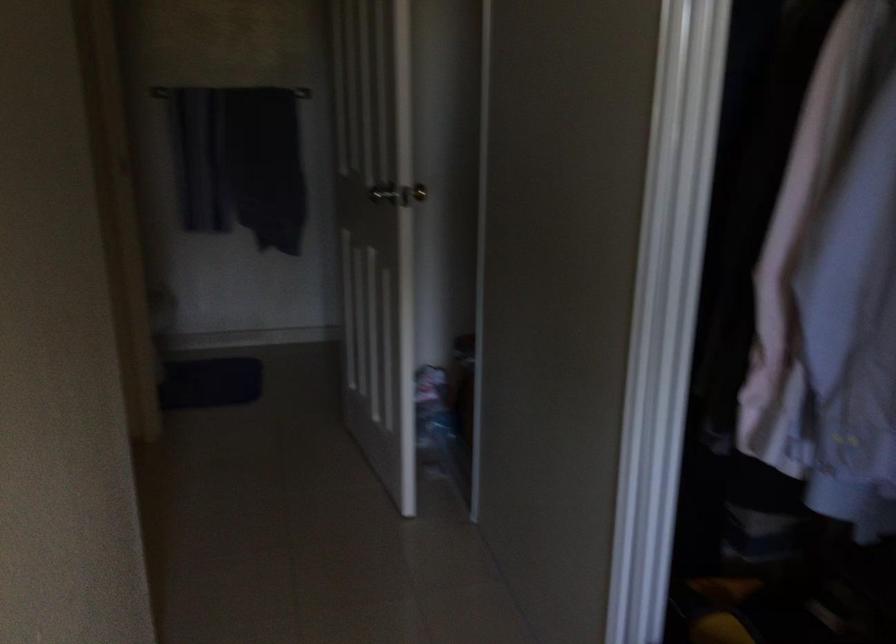
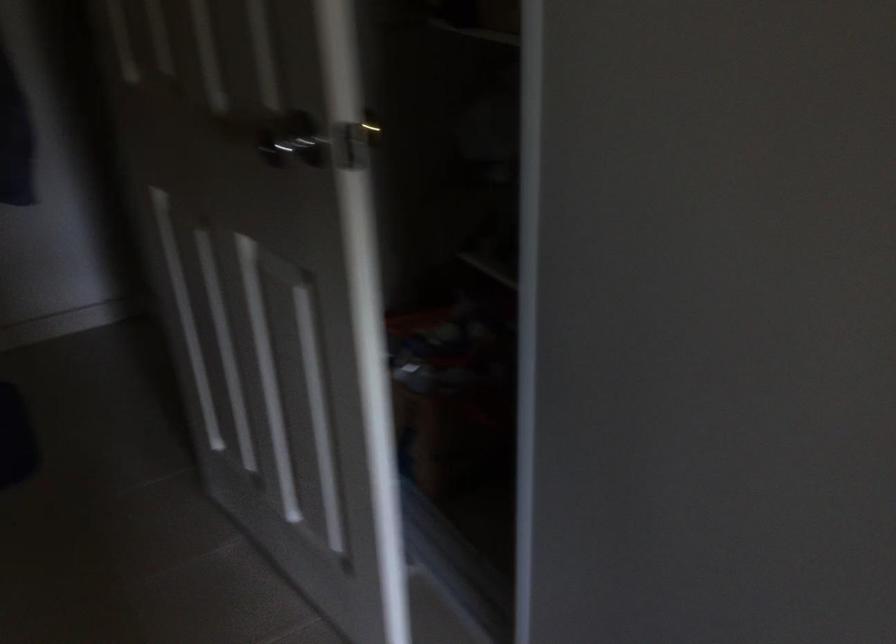
Question: The images are taken continuously from a first-person perspective. In which direction are you moving?

Choices:
 (A) Left
 (B) Right
 (C) Forward
 (D) Backward

Answer: (C)